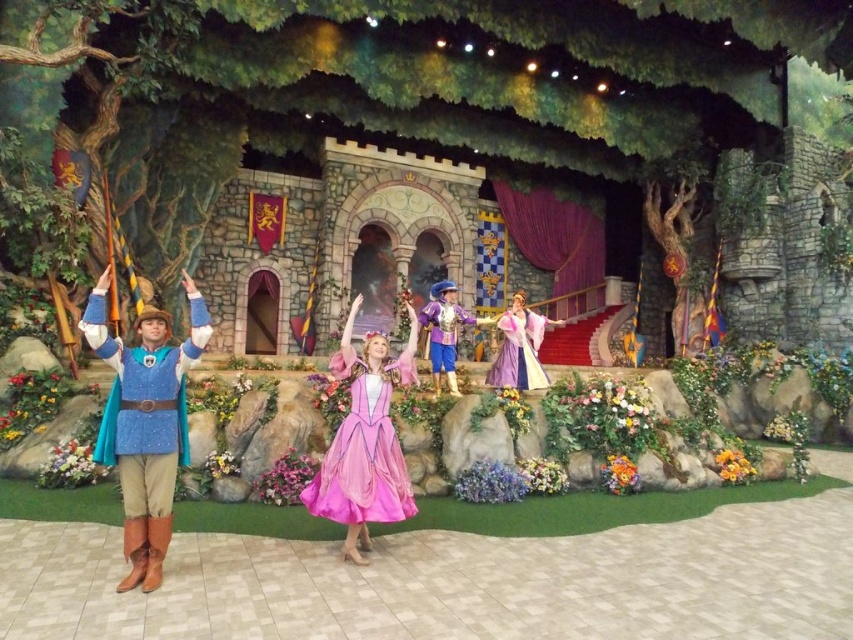
You are a stagehand adjusting the lighting for the performance. You need to place a spotlight on the point closer to the camera between point (131,353) and point (346,380). Which point should you choose?

Point (131,353) is closer to the camera than point (346,380), so you should place the spotlight on point (131,353).

You are standing at the camera position and want to know how far the point at coordinates (125, 556) is from you. Can you determine the distance?

The point at coordinates (125, 556) is 4.01 meters away from the camera position.

You are standing on the stage and see the point at coordinates (144, 422). What object is this point located on?

The point at coordinates (144, 422) is located on the blue fabric cape at left.